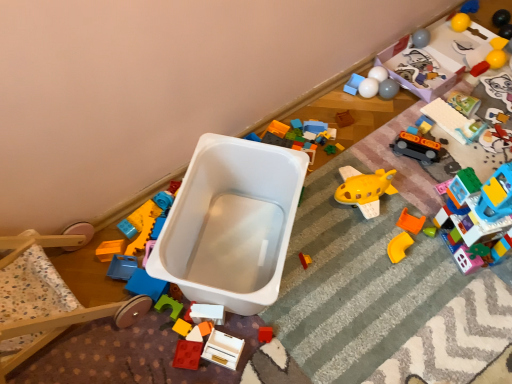
Identify the location of vacant space that's between white plastic toy at center, the 14th toy when ordered from right to left, and orange plastic block at lower right, placed as the 10th toy when sorted from left to right. This screenshot has width=512, height=384. (333, 260).